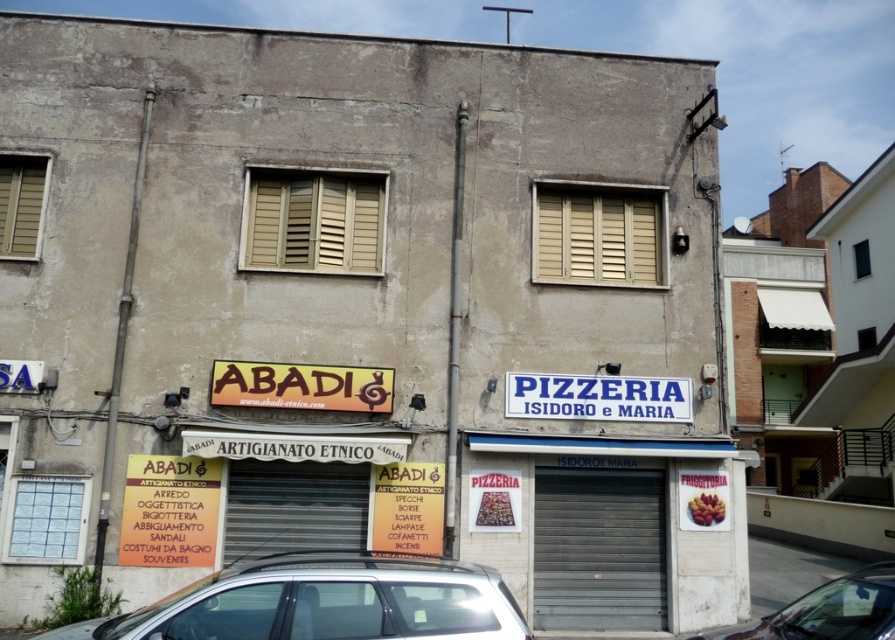
Where is `black matte shutter at center`? black matte shutter at center is located at coordinates (293, 508).

What do you see at coordinates (293, 508) in the screenshot? This screenshot has width=895, height=640. I see `black matte shutter at center` at bounding box center [293, 508].

Locate an element on the screen. This screenshot has width=895, height=640. black matte shutter at center is located at coordinates (293, 508).

Who is positioned more to the left, metallic silver car at lower center or beige wooden shutter at left?

Positioned to the left is beige wooden shutter at left.

Which is behind, point (257, 588) or point (28, 182)?

Point (28, 182)

Measure the distance between metallic silver car at lower center and camera.

metallic silver car at lower center is 5.15 meters from camera.

Where is `metallic silver car at lower center`? metallic silver car at lower center is located at coordinates (325, 602).

How far apart are metallic silver car at lower center and black matte shutter at center?

metallic silver car at lower center and black matte shutter at center are 4.17 meters apart from each other.

Is point (445, 588) positioned in front of point (269, 518)?

Yes, it is in front of point (269, 518).

The width and height of the screenshot is (895, 640). Describe the element at coordinates (325, 602) in the screenshot. I see `metallic silver car at lower center` at that location.

Where is `metallic silver car at lower center`? The width and height of the screenshot is (895, 640). metallic silver car at lower center is located at coordinates (325, 602).